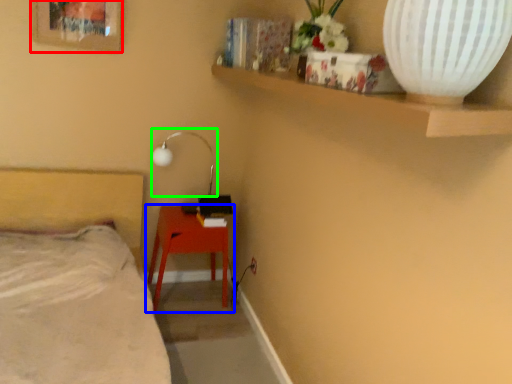
Question: Which is farther away from picture frame (highlighted by a red box)? table (highlighted by a blue box) or lamp (highlighted by a green box)?

Choices:
 (A) table
 (B) lamp

Answer: (A)